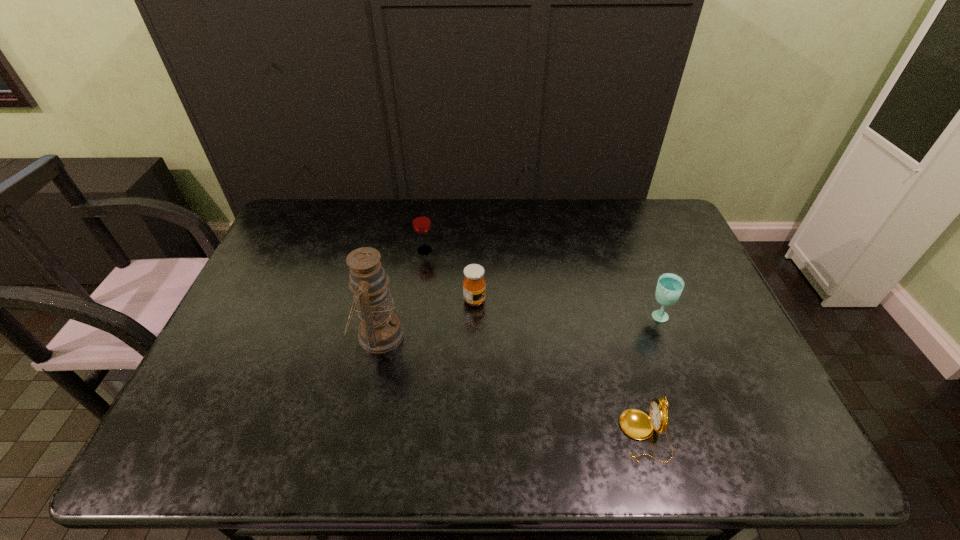
Identify the location of vacant space located 0.140m on the front of the rightmost object. This screenshot has width=960, height=540. (678, 368).

Where is `free location located 0.230m on the front-facing side of the third object from right to left`? This screenshot has height=540, width=960. free location located 0.230m on the front-facing side of the third object from right to left is located at coordinates (564, 300).

This screenshot has height=540, width=960. Find the location of `vacant space located 0.340m on the face of the pocket watch`. vacant space located 0.340m on the face of the pocket watch is located at coordinates (469, 435).

I want to click on vacant space located on the face of the pocket watch, so click(x=506, y=435).

I want to click on vacant space located on the face of the pocket watch, so click(x=506, y=435).

This screenshot has height=540, width=960. What are the coordinates of `object that is at the near edge` in the screenshot? It's located at (638, 425).

What are the coordinates of `object situated at the right edge` in the screenshot? It's located at (669, 287).

This screenshot has height=540, width=960. In the image, there is a desktop. What are the coordinates of `free space at the far edge` in the screenshot? It's located at (392, 204).

You are a GUI agent. You are given a task and a screenshot of the screen. Output one action in this format:
    pyautogui.click(x=<x>, y=<y>)
    Task: Click on the vacant position at the near edge of the desktop
    This screenshot has height=540, width=960.
    Given the screenshot: What is the action you would take?
    point(325,456)

Identify the location of free location at the left edge. This screenshot has width=960, height=540. (226, 384).